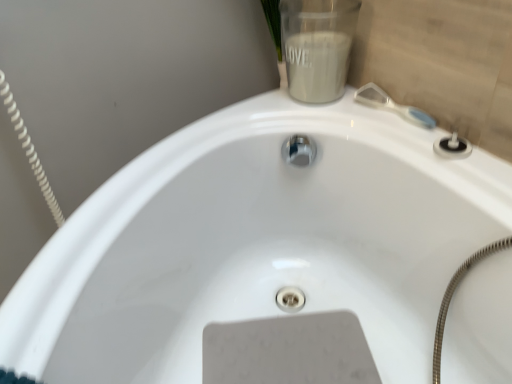
Where is `matte white jar at upper right`? This screenshot has width=512, height=384. matte white jar at upper right is located at coordinates (317, 65).

What do you see at coordinates (317, 65) in the screenshot? I see `matte white jar at upper right` at bounding box center [317, 65].

Find the location of a particular element. clear plastic brush at upper right is located at coordinates (392, 105).

This screenshot has width=512, height=384. What do you see at coordinates (392, 105) in the screenshot? I see `clear plastic brush at upper right` at bounding box center [392, 105].

What are the coordinates of `matte white jar at upper right` in the screenshot? It's located at (317, 65).

Based on the photo, which is more to the left, matte white jar at upper right or clear plastic brush at upper right?

matte white jar at upper right is more to the left.

Is matte white jar at upper right positioned behind clear plastic brush at upper right?

Yes, matte white jar at upper right is further from the camera.

Is point (306, 53) closer to camera compared to point (365, 87)?

Yes.

From the image's perspective, is matte white jar at upper right under clear plastic brush at upper right?

Incorrect, from the image's perspective, matte white jar at upper right is higher than clear plastic brush at upper right.

From a real-world perspective, who is located higher, matte white jar at upper right or clear plastic brush at upper right?

In real-world perspective, matte white jar at upper right is above.

Which of these two, matte white jar at upper right or clear plastic brush at upper right, is wider?

With larger width is matte white jar at upper right.

Can you confirm if matte white jar at upper right is shorter than clear plastic brush at upper right?

No, matte white jar at upper right is not shorter than clear plastic brush at upper right.

Considering the sizes of objects matte white jar at upper right and clear plastic brush at upper right in the image provided, who is bigger, matte white jar at upper right or clear plastic brush at upper right?

Bigger between the two is matte white jar at upper right.

Is matte white jar at upper right not inside clear plastic brush at upper right?

Absolutely, matte white jar at upper right is external to clear plastic brush at upper right.

From the picture: Is matte white jar at upper right not close to clear plastic brush at upper right?

They are positioned close to each other.

Could you tell me if matte white jar at upper right is turned towards clear plastic brush at upper right?

No, matte white jar at upper right is not facing towards clear plastic brush at upper right.

How much distance is there between matte white jar at upper right and clear plastic brush at upper right?

matte white jar at upper right and clear plastic brush at upper right are 5.31 inches apart.

The image size is (512, 384). What are the coordinates of `liquid lying on the left of clear plastic brush at upper right` in the screenshot? It's located at (317, 65).

Between clear plastic brush at upper right and matte white jar at upper right, which one appears on the right side from the viewer's perspective?

Positioned to the right is clear plastic brush at upper right.

Is clear plastic brush at upper right positioned in front of matte white jar at upper right?

That is True.

Does point (367, 97) come closer to viewer compared to point (349, 46)?

No, it is behind (349, 46).

From the image's perspective, is clear plastic brush at upper right on top of matte white jar at upper right?

No.

From a real-world perspective, is clear plastic brush at upper right on top of matte white jar at upper right?

No, from a real-world perspective, clear plastic brush at upper right is not on top of matte white jar at upper right.

Can you confirm if clear plastic brush at upper right is wider than matte white jar at upper right?

No, clear plastic brush at upper right is not wider than matte white jar at upper right.

Considering the relative sizes of clear plastic brush at upper right and matte white jar at upper right in the image provided, is clear plastic brush at upper right taller than matte white jar at upper right?

No.

From the picture: Does clear plastic brush at upper right have a smaller size compared to matte white jar at upper right?

Correct, clear plastic brush at upper right occupies less space than matte white jar at upper right.

Could matte white jar at upper right be considered to be inside clear plastic brush at upper right?

Actually, matte white jar at upper right is outside clear plastic brush at upper right.

Are clear plastic brush at upper right and matte white jar at upper right far apart?

They are positioned close to each other.

Looking at this image, does clear plastic brush at upper right turn towards matte white jar at upper right?

No, clear plastic brush at upper right is not facing towards matte white jar at upper right.

The image size is (512, 384). I want to click on liquid that is behind the clear plastic brush at upper right, so click(317, 65).

Find the location of a particular element. This screenshot has height=384, width=512. plumbing fixture beneath the matte white jar at upper right (from a real-world perspective) is located at coordinates (392, 105).

What are the coordinates of `plumbing fixture below the matte white jar at upper right (from the image's perspective)` in the screenshot? It's located at [392, 105].